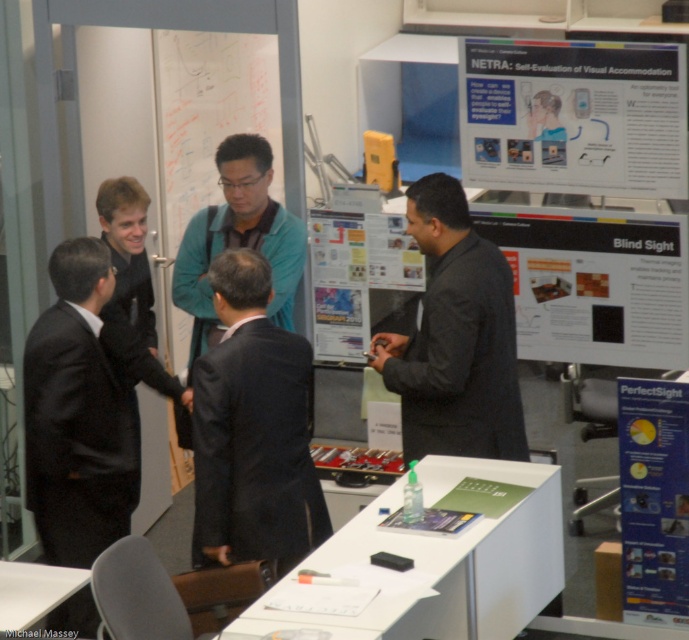
Question: Which of the following is the closest to the observer?

Choices:
 (A) (582, 161)
 (B) (70, 456)

Answer: (B)

Question: Which object appears farthest from the camera in this image?

Choices:
 (A) teal fabric shirt at center
 (B) black suit at center
 (C) dark gray suit at center
 (D) white paper at lower right

Answer: (A)

Question: Where is white paper poster at center located in relation to black suit at left in the image?

Choices:
 (A) right
 (B) left

Answer: (A)

Question: Is white paper at upper right wider than white paper at lower right?

Choices:
 (A) yes
 (B) no

Answer: (A)

Question: Among these objects, which one is nearest to the camera?

Choices:
 (A) white paper at lower right
 (B) black suit at center

Answer: (B)

Question: Can you confirm if black suit at center is positioned below black suit at left?

Choices:
 (A) no
 (B) yes

Answer: (A)